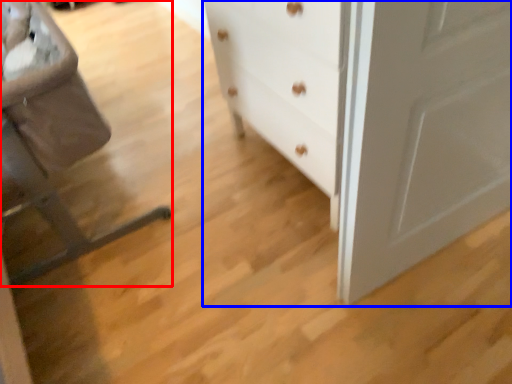
Question: Which point is further to the camera, rocking chair (highlighted by a red box) or chest of drawers (highlighted by a blue box)?

Choices:
 (A) rocking chair
 (B) chest of drawers

Answer: (B)